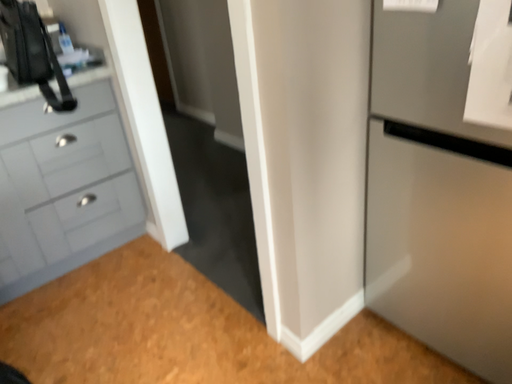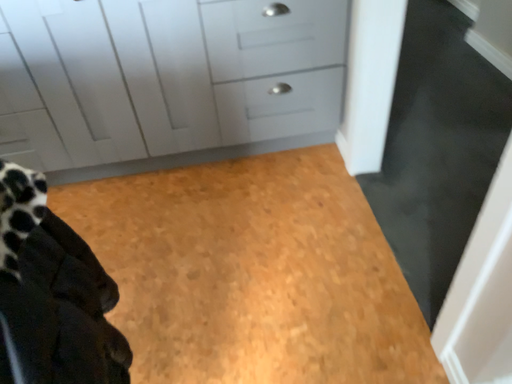
Question: How did the camera likely rotate when shooting the video?

Choices:
 (A) rotated right
 (B) rotated left

Answer: (B)